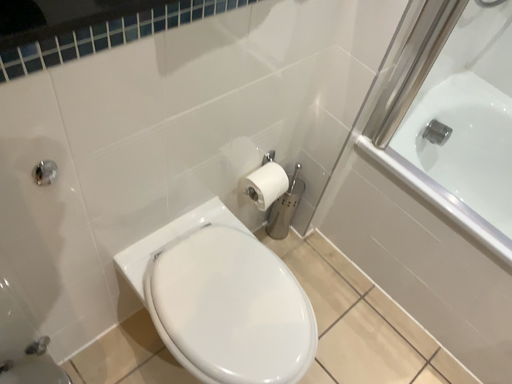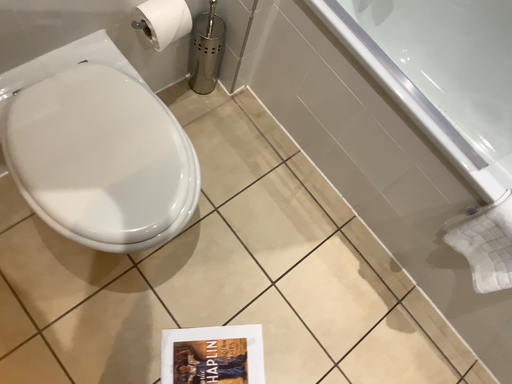
Question: How did the camera likely rotate when shooting the video?

Choices:
 (A) rotated upward
 (B) rotated downward

Answer: (B)